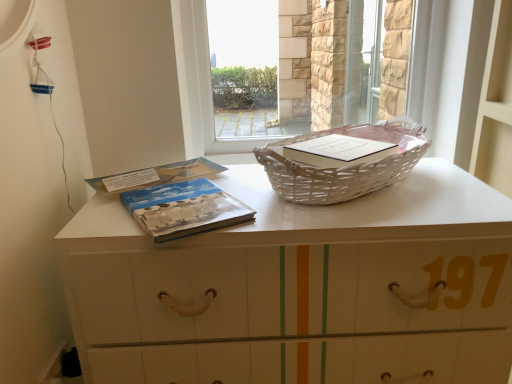
Question: Considering the relative sizes of white wicker basket at upper center and matte blue cover book at center, the first paperback book positioned from the front, in the image provided, is white wicker basket at upper center wider than matte blue cover book at center, the first paperback book positioned from the front,?

Choices:
 (A) no
 (B) yes

Answer: (B)

Question: Is the surface of white wicker basket at upper center in direct contact with matte blue cover book at center, the first paperback book positioned from the front?

Choices:
 (A) yes
 (B) no

Answer: (B)

Question: Can you confirm if white wicker basket at upper center is smaller than matte blue cover book at center, the first paperback book positioned from the front?

Choices:
 (A) yes
 (B) no

Answer: (B)

Question: Considering the relative positions of white wicker basket at upper center and matte blue cover book at center, the first paperback book positioned from the front, in the image provided, is white wicker basket at upper center in front of matte blue cover book at center, the first paperback book positioned from the front,?

Choices:
 (A) yes
 (B) no

Answer: (A)

Question: Considering the relative sizes of white wicker basket at upper center and matte blue cover book at center, the first paperback book positioned from the front, in the image provided, is white wicker basket at upper center shorter than matte blue cover book at center, the first paperback book positioned from the front,?

Choices:
 (A) no
 (B) yes

Answer: (A)

Question: Is white wicker basket at upper center turned away from matte blue cover book at center, the first paperback book positioned from the front?

Choices:
 (A) yes
 (B) no

Answer: (B)

Question: From a real-world perspective, does white wicker picnic basket at center sit lower than white wicker basket at upper center?

Choices:
 (A) yes
 (B) no

Answer: (B)

Question: From the image's perspective, is white wicker picnic basket at center located above white wicker basket at upper center?

Choices:
 (A) no
 (B) yes

Answer: (B)

Question: Can you confirm if white wicker picnic basket at center is wider than white wicker basket at upper center?

Choices:
 (A) yes
 (B) no

Answer: (B)

Question: Can we say white wicker picnic basket at center lies outside white wicker basket at upper center?

Choices:
 (A) yes
 (B) no

Answer: (A)

Question: From a real-world perspective, is white wicker picnic basket at center physically above white wicker basket at upper center?

Choices:
 (A) no
 (B) yes

Answer: (B)

Question: Considering the relative sizes of white wicker picnic basket at center and white wicker basket at upper center in the image provided, is white wicker picnic basket at center smaller than white wicker basket at upper center?

Choices:
 (A) yes
 (B) no

Answer: (A)

Question: Is the position of white wicker picnic basket at center more distant than that of blue matte book at center, the second paperback book when ordered from front to back?

Choices:
 (A) no
 (B) yes

Answer: (A)